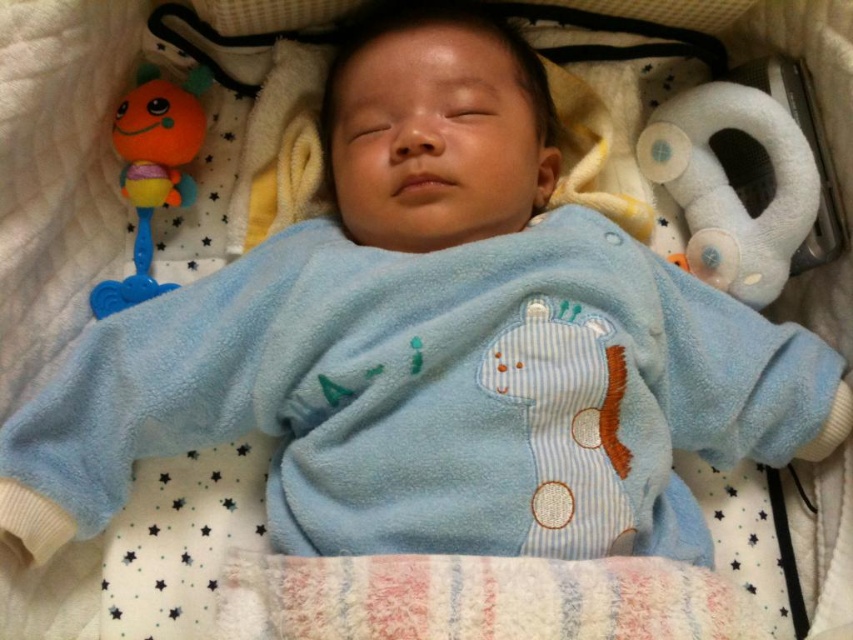
Based on the photo, you are a parent who wants to place a new toy near the smooth blue baby at center. The toy you have is 12 inches long. Can you place it without overlapping the baby?

The distance between the smooth blue baby at center and the new toy is 34.38 inches. Since the toy is only 12 inches long, there is enough space to place it without overlapping the baby.

You are a parent trying to locate your baby toys. You see the white plush teether at upper right and the orange rubber rattle at upper left. Which toy is closer to the baby?

The white plush teether at upper right is closer to the baby because the orange rubber rattle at upper left is behind it.

You are a parent trying to place a pacifier between the white plush teether at upper right and the orange rubber rattle at upper left. The pacifier is 10 centimeters long. Will it fit between them?

The distance between the white plush teether at upper right and orange rubber rattle at upper left is 64.50 centimeters. Since the pacifier is only 10 centimeters long, there is enough space to place it between them.